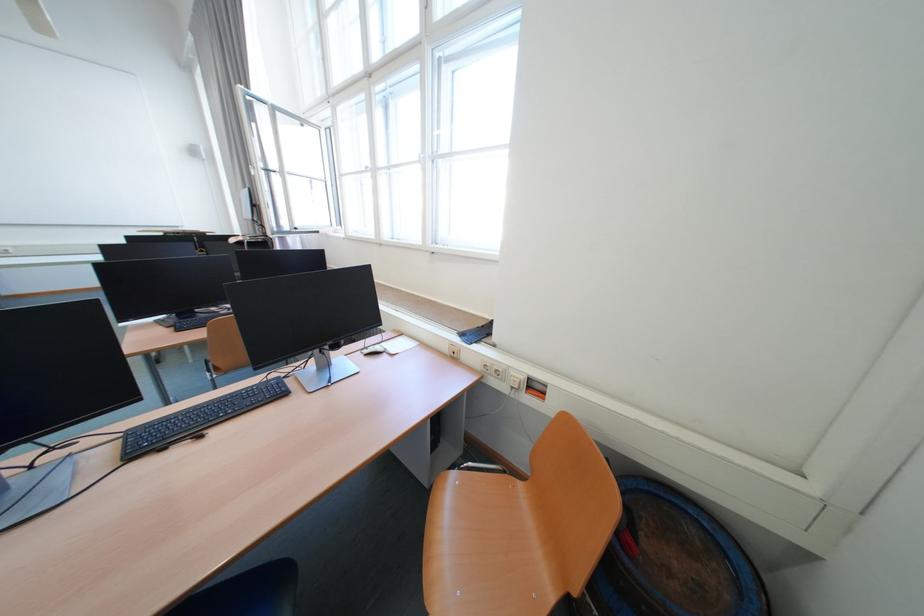
This screenshot has width=924, height=616. Describe the element at coordinates (421, 159) in the screenshot. I see `the window handle` at that location.